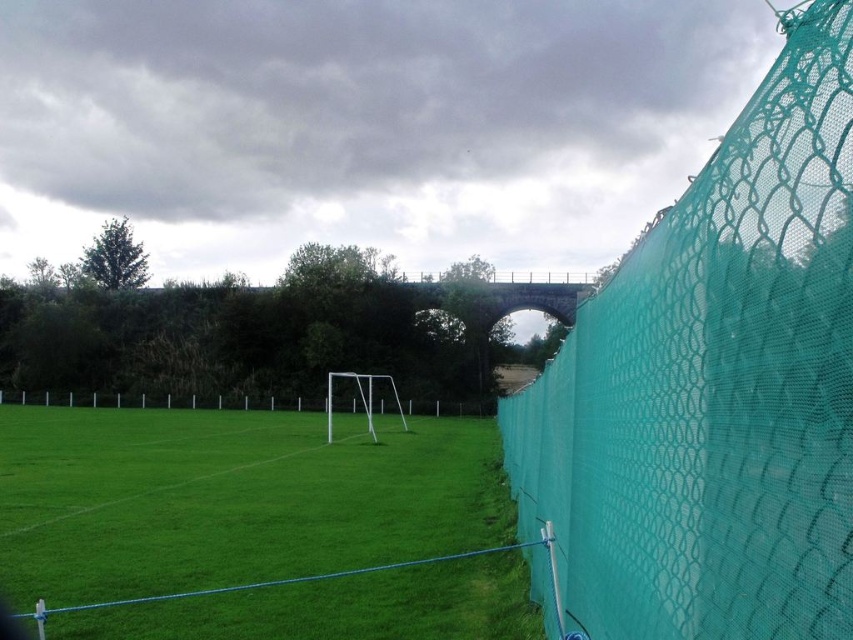
How distant is teal mesh fence at right from green grass at lower left?

teal mesh fence at right is 6.14 meters away from green grass at lower left.

Does teal mesh fence at right appear over green grass at lower left?

Yes.

At what (x,y) coordinates should I click in order to perform the action: click on teal mesh fence at right. Please return your answer as a coordinate pair (x, y). The image size is (853, 640). Looking at the image, I should click on (715, 387).

Where is `teal mesh fence at right`? The image size is (853, 640). teal mesh fence at right is located at coordinates (715, 387).

Does green grass at lower left appear under green mesh fence at center?

No.

Image resolution: width=853 pixels, height=640 pixels. I want to click on green grass at lower left, so click(231, 499).

Consider the image. Is teal mesh fence at right bigger than green mesh fence at center?

Yes.

Does point (631, 365) lie in front of point (357, 396)?

Yes, point (631, 365) is closer to viewer.

Where is `teal mesh fence at right`? teal mesh fence at right is located at coordinates point(715,387).